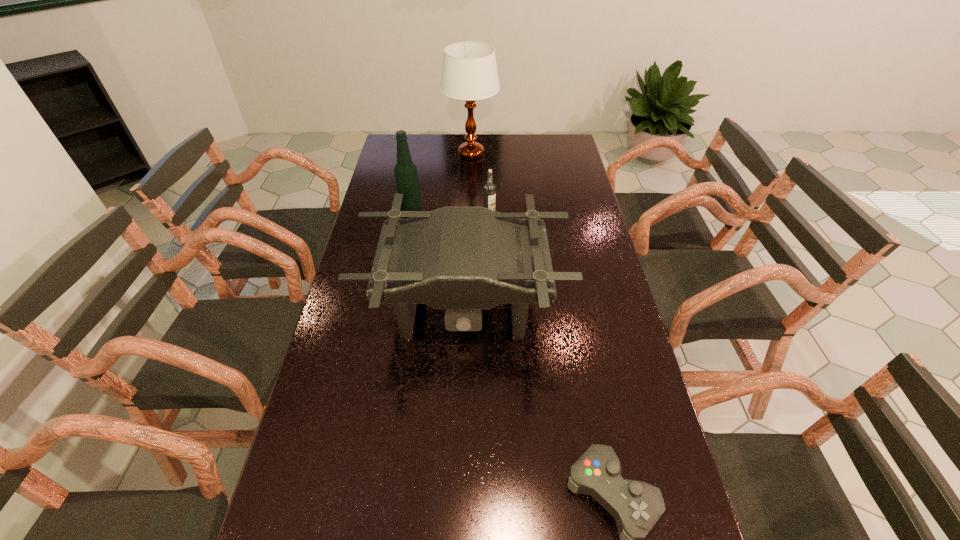
The width and height of the screenshot is (960, 540). I want to click on object that is at the far edge, so click(469, 73).

Find the location of `alcohol situated at the left edge`. alcohol situated at the left edge is located at coordinates (406, 175).

Find the location of `drone at the left edge`. drone at the left edge is located at coordinates (463, 260).

Locate an element on the screen. free space at the far edge of the desktop is located at coordinates (512, 134).

The height and width of the screenshot is (540, 960). Identify the location of vacant space at the left edge. (352, 292).

You are a GUI agent. You are given a task and a screenshot of the screen. Output one action in this format:
    pyautogui.click(x=<x>, y=<y>)
    Task: Click on the free space at the right edge
    
    Given the screenshot: What is the action you would take?
    (596, 357)

At what (x,y) coordinates should I click in order to perform the action: click on free spot between the table lamp and the fourth tallest object. Please return your answer as a coordinate pair (x, y). Looking at the image, I should click on (480, 185).

This screenshot has width=960, height=540. What are the coordinates of `object that stands as the fourth closest to the third tallest object` in the screenshot? It's located at [x=469, y=73].

You are a GUI agent. You are given a task and a screenshot of the screen. Output one action in this format:
    pyautogui.click(x=<x>, y=<y>)
    Task: Click on the closest object to the second tallest object
    
    Given the screenshot: What is the action you would take?
    pyautogui.click(x=463, y=260)